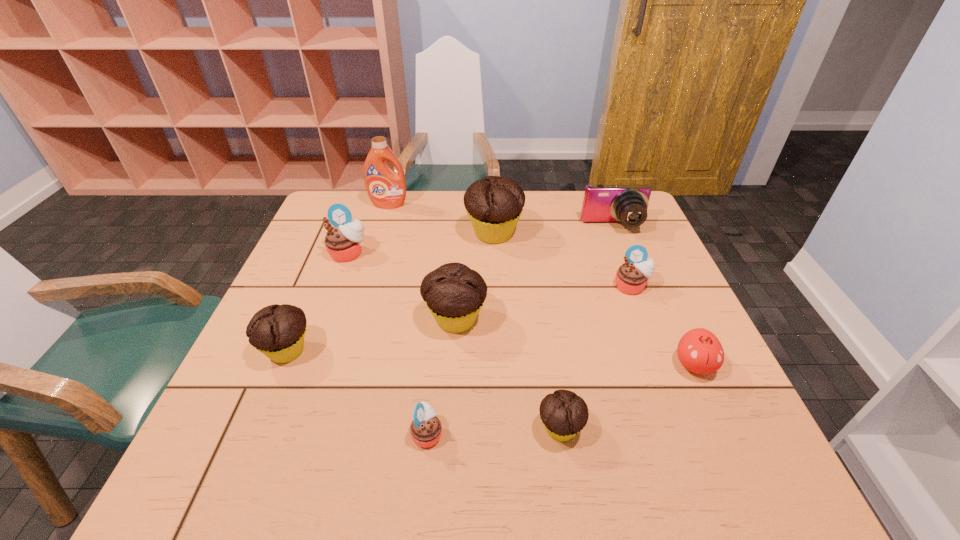
The height and width of the screenshot is (540, 960). Find the location of `apple`. apple is located at coordinates (699, 350).

Find the location of a particular element. The image size is (960, 540). the second pink muffin from left to right is located at coordinates (425, 430).

Locate an element on the screen. The width and height of the screenshot is (960, 540). the smallest pink muffin is located at coordinates (425, 430).

You are a GUI agent. You are given a task and a screenshot of the screen. Output one action in this format:
    pyautogui.click(x=<x>, y=<y>)
    Task: Click on the nearest chocolate muffin
    The image size is (960, 540).
    Given the screenshot: What is the action you would take?
    pyautogui.click(x=564, y=414)

You are a GUI agent. You are given a task and a screenshot of the screen. Output one action in this format:
    pyautogui.click(x=<x>, y=<y>)
    Task: Click on the free region located 0.240m on the front-facing side of the detergent
    Image resolution: width=960 pixels, height=540 pixels.
    Given the screenshot: What is the action you would take?
    pyautogui.click(x=374, y=255)

This screenshot has height=540, width=960. Find the location of `vacant space located 0.300m on the left of the biggest chocolate muffin`. vacant space located 0.300m on the left of the biggest chocolate muffin is located at coordinates (364, 233).

At what (x,y) coordinates should I click in order to perform the action: click on vacant region located on the front-facing side of the leftmost pink muffin. Please return your answer as a coordinate pair (x, y). Looking at the image, I should click on (311, 357).

This screenshot has width=960, height=540. Identify the location of vacant space located on the right of the second biggest chocolate muffin. (630, 320).

This screenshot has width=960, height=540. What are the coordinates of `vacant area situated 0.350m on the front-facing side of the camera` in the screenshot? It's located at (652, 322).

In order to click on vacant region located 0.180m on the front-facing side of the second farthest pink muffin in this screenshot , I will do `click(657, 353)`.